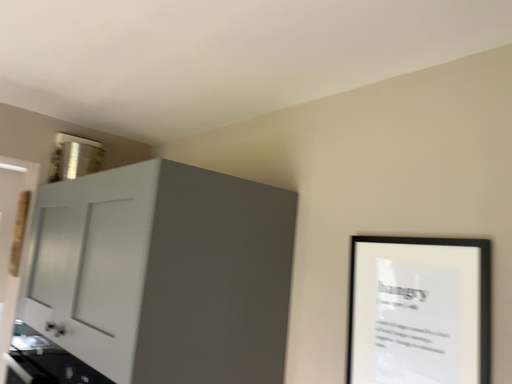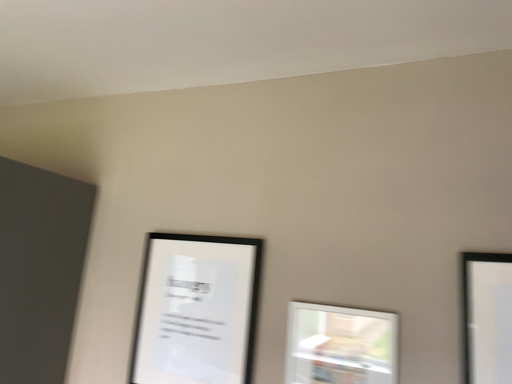
Question: How did the camera likely rotate when shooting the video?

Choices:
 (A) rotated left
 (B) rotated right

Answer: (B)